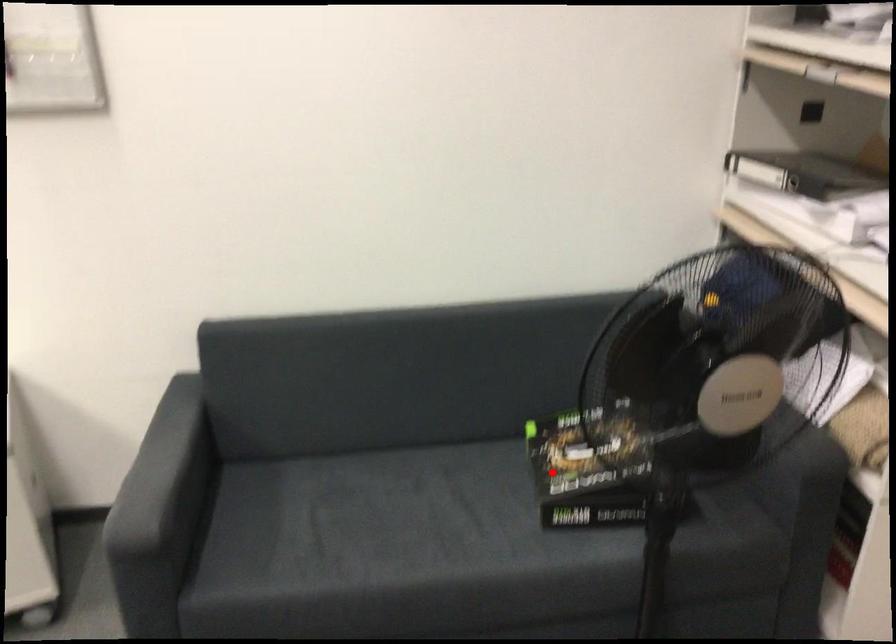
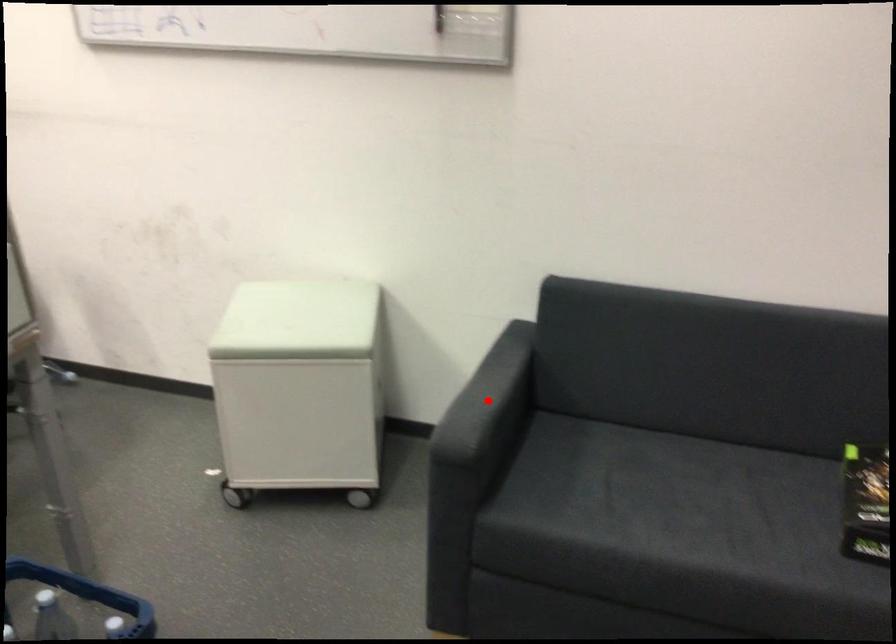
I am providing you with two images of the same scene from different viewpoints. A red point is marked on the first image and another point is marked on the second image. Is the marked point in image1 the same physical position as the marked point in image2?

No